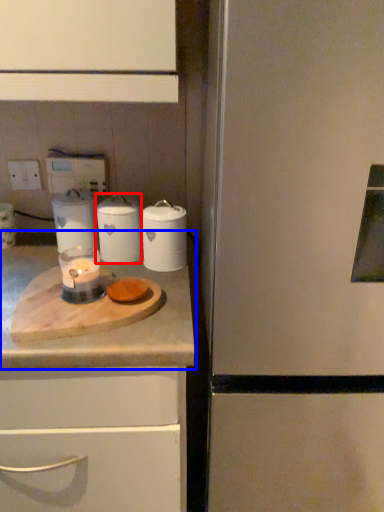
Question: Which object appears closest to the camera in this image, kitchen appliance (highlighted by a red box) or countertop (highlighted by a blue box)?

Choices:
 (A) kitchen appliance
 (B) countertop

Answer: (B)